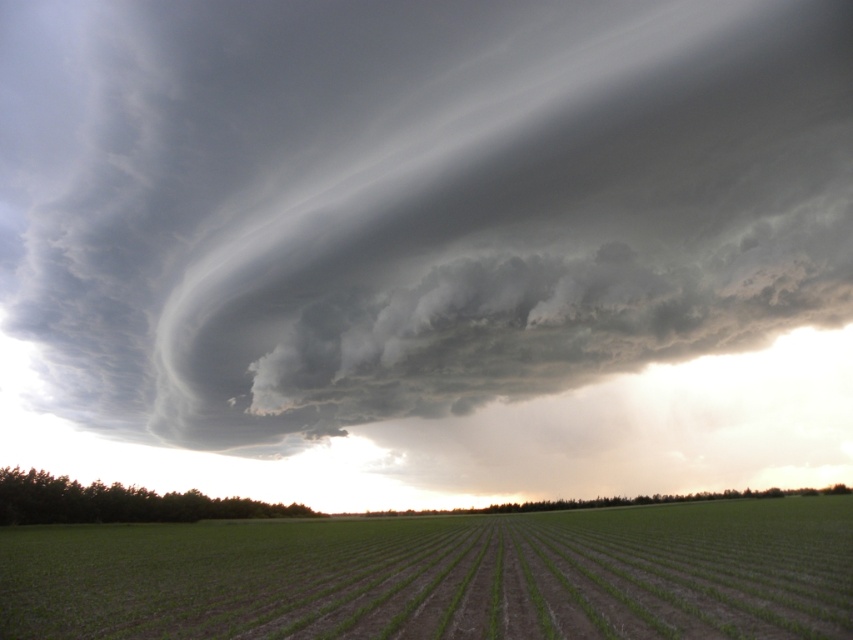
You are a farmer standing in the middle of your field. You notice the dark gray cloud at upper center and the green grass at center. How far apart are these two objects?

The dark gray cloud at upper center and green grass at center are 357.12 feet apart from each other.

You are a weather observer standing in the middle of the green grass at center. Looking up, you notice the dark gray cloud at upper center. Based on their sizes, which object covers a larger area in the sky compared to the other?

The dark gray cloud at upper center has a greater width than the green grass at center, so the dark gray cloud at upper center covers a larger area in the sky.